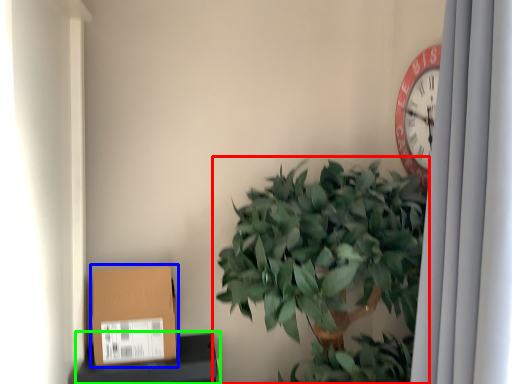
Question: Which object is positioned farthest from houseplant (highlighted by a red box)? Select from cardboard box (highlighted by a blue box) and furniture (highlighted by a green box).

Choices:
 (A) cardboard box
 (B) furniture

Answer: (B)